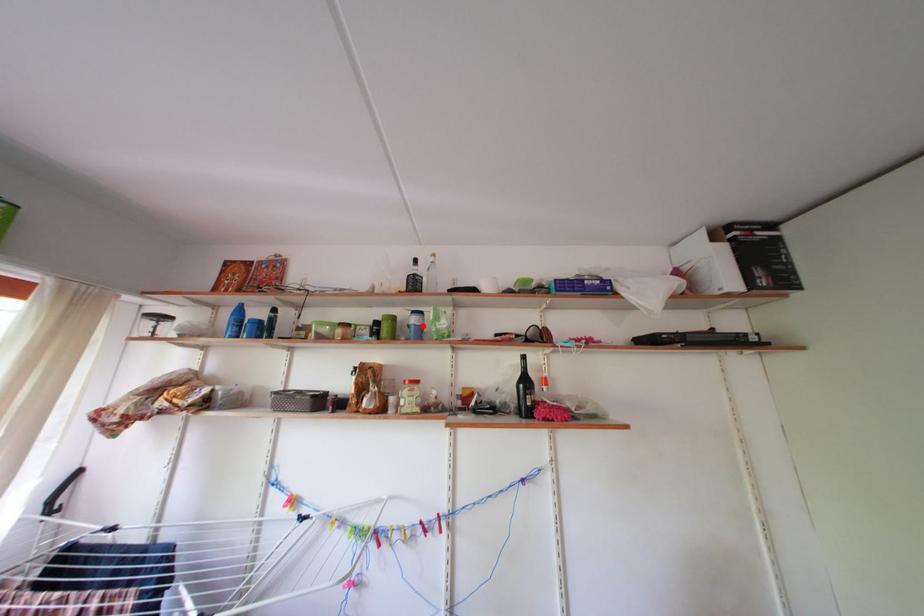
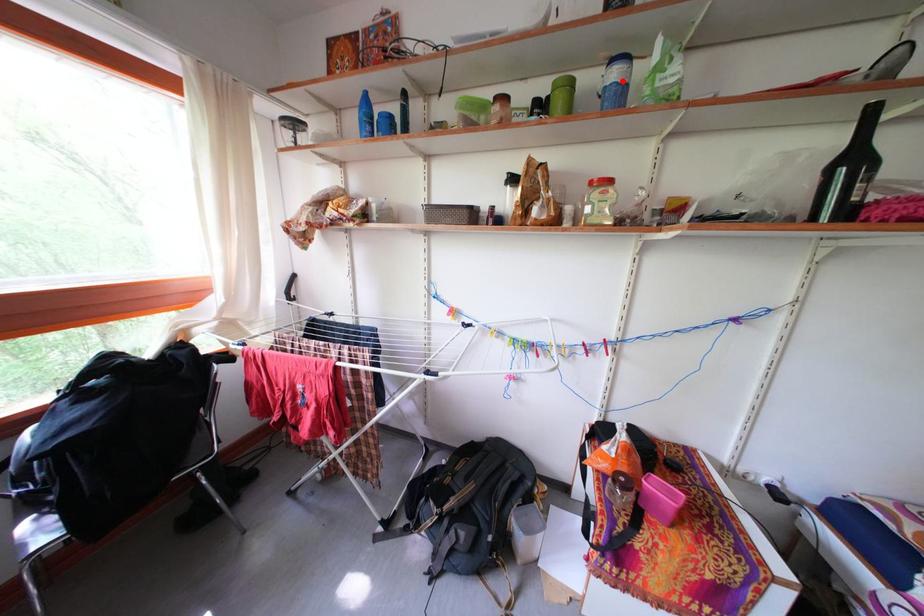
I am providing you with two images of the same scene from different viewpoints. A red point is marked on the first image and another point is marked on the second image. Does the point marked in image1 correspond to the same location as the one in image2?

Yes